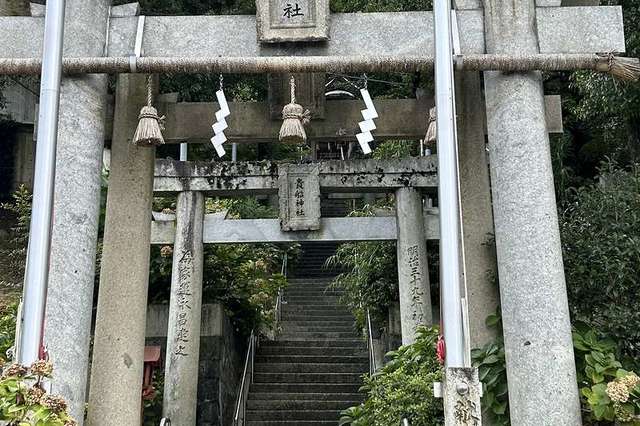
Where is `rightmost hand rail`? The height and width of the screenshot is (426, 640). rightmost hand rail is located at coordinates (371, 346).